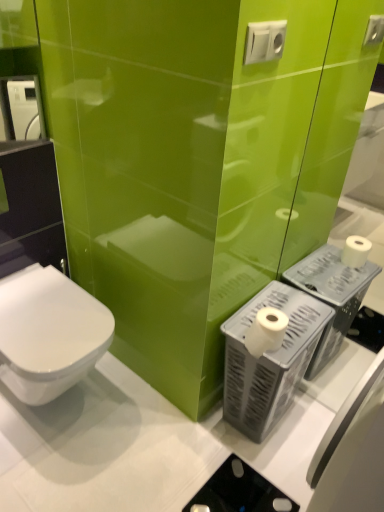
Find the location of a particular element. The image size is (384, 512). free space above white plastic toilet paper holder at lower right (from a real-world perspective) is located at coordinates (289, 317).